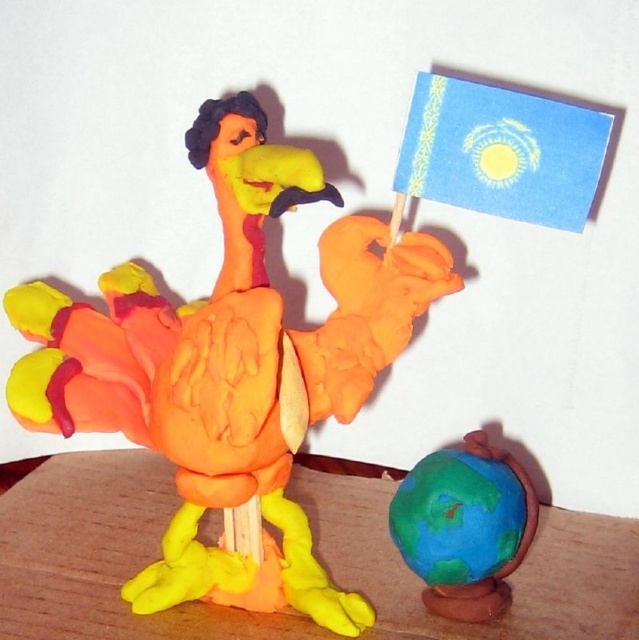
You are a small insect. You want to land on the clay bird at center. The coordinates of the point you want to land on are point (231, 369). Is this point on the clay bird at center?

Yes, the point (231, 369) is on the matte clay bird at center according to the description.

You are standing in front of the clay sculpture of a bird. There are two points marked on the sculpture. The first point is at coordinates point (134, 497) and the second point is at point (564, 180). Which point is closer to you?

Point (134, 497) is further to the camera than point (564, 180), so the point closer to you is point (564, 180).

You are an art student who wants to take a photo of the matte clay bird at center and the wooden table at lower center. Which object should you focus on first if you want to capture both in a single shot without moving the camera?

You should focus on the matte clay bird at center first because it is closer to the viewer than the wooden table at lower center, ensuring both are in focus when using a shallow depth of field.